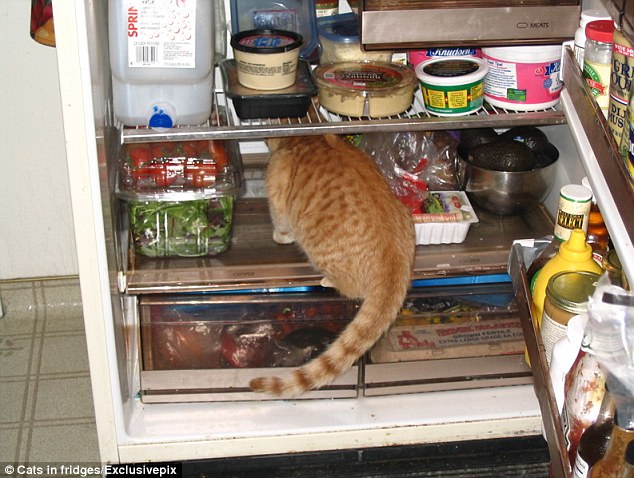
The width and height of the screenshot is (634, 478). I want to click on bottom ddrawers in refrigerator, so click(182, 392), click(441, 357).